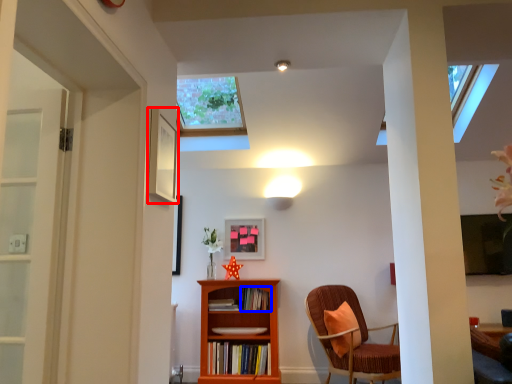
Question: Among these objects, which one is nearest to the camera, picture frame (highlighted by a red box) or book (highlighted by a blue box)?

Choices:
 (A) picture frame
 (B) book

Answer: (A)